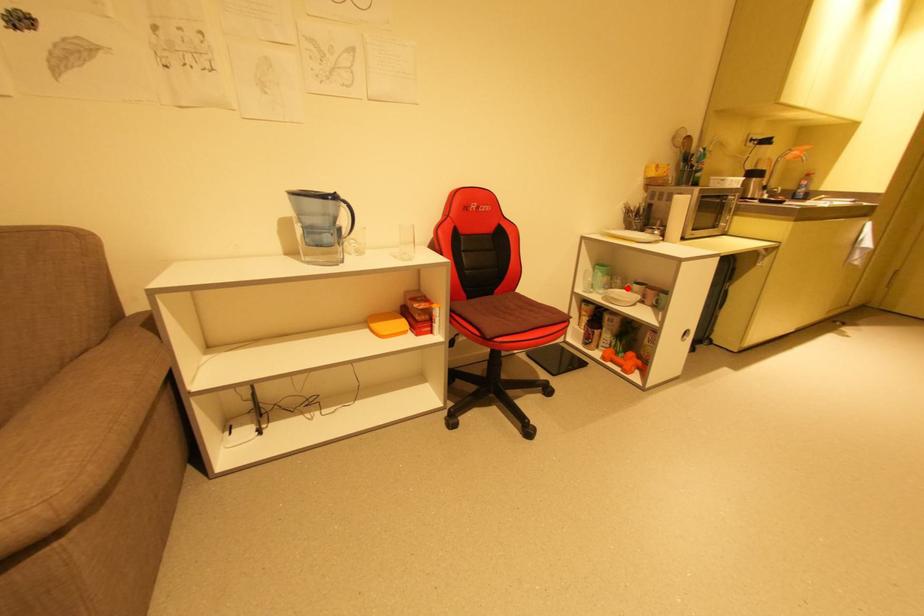
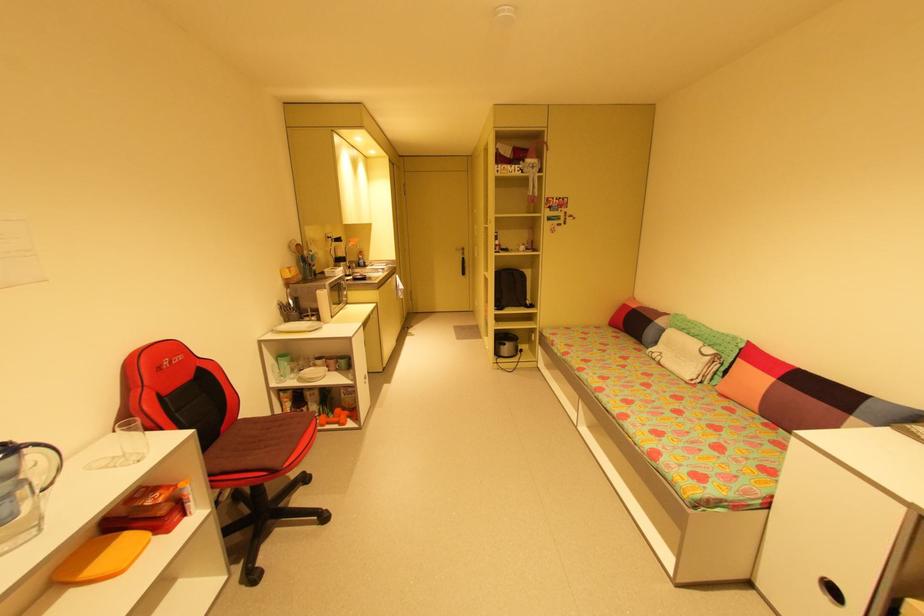
In the second image, find the point that corresponds to the highlighted location in the first image.

(313, 367)